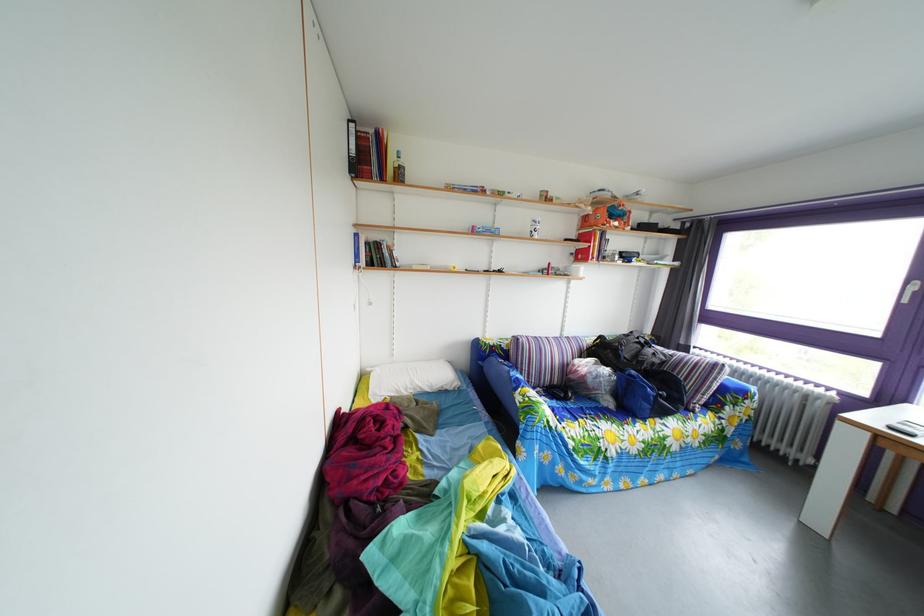
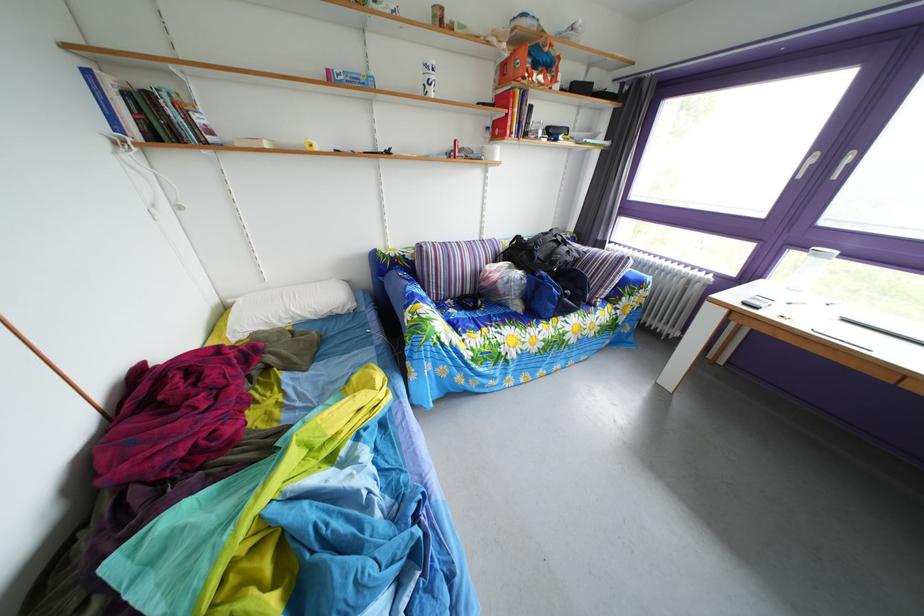
The point at (484, 236) is marked in the first image. Where is the corresponding point in the second image?

(339, 79)